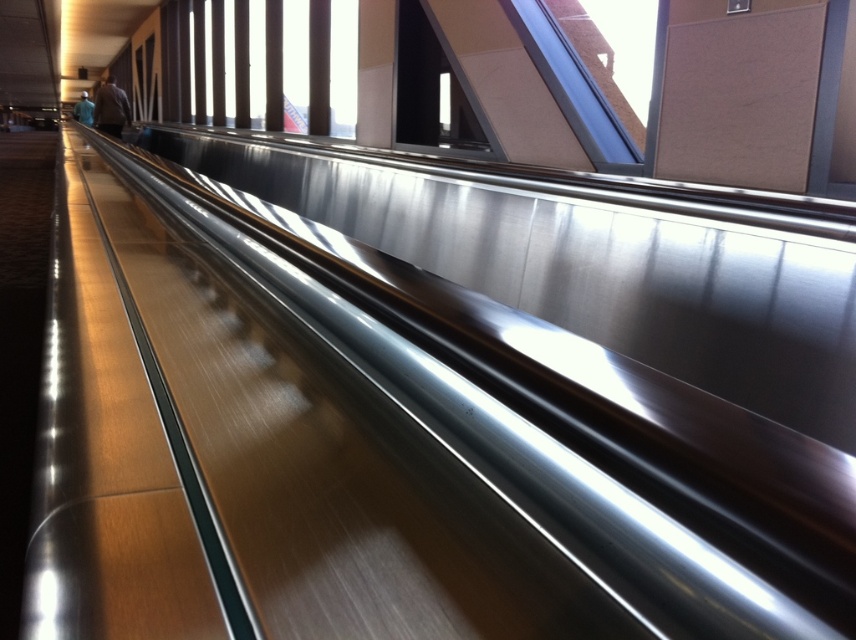
The image size is (856, 640). What do you see at coordinates (111, 108) in the screenshot?
I see `dark blue shirt at upper left` at bounding box center [111, 108].

Who is higher up, dark blue shirt at upper left or light blue shirt at upper left?

Positioned higher is light blue shirt at upper left.

You are a GUI agent. You are given a task and a screenshot of the screen. Output one action in this format:
    pyautogui.click(x=<x>, y=<y>)
    Task: Click on the dark blue shirt at upper left
    
    Given the screenshot: What is the action you would take?
    pyautogui.click(x=111, y=108)

You are a GUI agent. You are given a task and a screenshot of the screen. Output one action in this format:
    pyautogui.click(x=<x>, y=<y>)
    Task: Click on the dark blue shirt at upper left
    Image resolution: width=856 pixels, height=640 pixels.
    Given the screenshot: What is the action you would take?
    pyautogui.click(x=111, y=108)